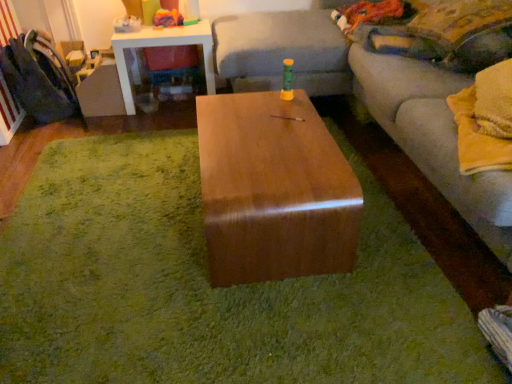
Question: Is shiny brown wood coffee table at center touching white glossy side table at upper left?

Choices:
 (A) yes
 (B) no

Answer: (B)

Question: Is shiny brown wood coffee table at center outside of white glossy side table at upper left?

Choices:
 (A) yes
 (B) no

Answer: (A)

Question: Does shiny brown wood coffee table at center have a lesser width compared to white glossy side table at upper left?

Choices:
 (A) yes
 (B) no

Answer: (A)

Question: Considering the relative sizes of shiny brown wood coffee table at center and white glossy side table at upper left in the image provided, is shiny brown wood coffee table at center bigger than white glossy side table at upper left?

Choices:
 (A) yes
 (B) no

Answer: (A)

Question: Is shiny brown wood coffee table at center behind white glossy side table at upper left?

Choices:
 (A) yes
 (B) no

Answer: (B)

Question: From the image's perspective, is rubberized plastic toy at upper left above or below velvet dark blue swivel chair at left?

Choices:
 (A) above
 (B) below

Answer: (A)

Question: Is point (188, 18) positioned closer to the camera than point (32, 39)?

Choices:
 (A) closer
 (B) farther

Answer: (B)

Question: Would you say rubberized plastic toy at upper left is inside or outside velvet dark blue swivel chair at left?

Choices:
 (A) outside
 (B) inside

Answer: (A)

Question: Based on their sizes in the image, would you say rubberized plastic toy at upper left is bigger or smaller than velvet dark blue swivel chair at left?

Choices:
 (A) small
 (B) big

Answer: (A)

Question: Considering the positions of brown glossy wood table at center and shiny brown wood coffee table at center in the image, is brown glossy wood table at center wider or thinner than shiny brown wood coffee table at center?

Choices:
 (A) wide
 (B) thin

Answer: (A)

Question: Would you say brown glossy wood table at center is to the left or to the right of shiny brown wood coffee table at center in the picture?

Choices:
 (A) left
 (B) right

Answer: (A)

Question: From the image's perspective, is brown glossy wood table at center positioned above or below shiny brown wood coffee table at center?

Choices:
 (A) above
 (B) below

Answer: (B)

Question: In terms of size, does brown glossy wood table at center appear bigger or smaller than shiny brown wood coffee table at center?

Choices:
 (A) big
 (B) small

Answer: (B)

Question: From the image's perspective, relative to brown glossy wood table at center, is velvet yellow pillow at upper right above or below?

Choices:
 (A) above
 (B) below

Answer: (A)

Question: Is velvet yellow pillow at upper right in front of or behind brown glossy wood table at center in the image?

Choices:
 (A) behind
 (B) front

Answer: (A)